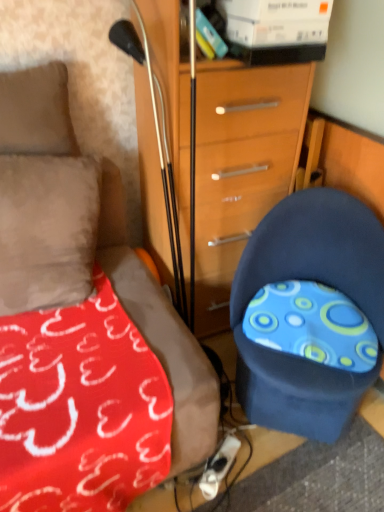
Locate an element on the screen. The image size is (384, 512). wooden chest of drawers at center is located at coordinates (240, 166).

The image size is (384, 512). In order to click on wooden chest of drawers at center in this screenshot , I will do `click(240, 166)`.

From a real-world perspective, is blue fabric chair at lower right above or below wooden chest of drawers at center?

In terms of real-world spatial position, blue fabric chair at lower right is below wooden chest of drawers at center.

Can wooden chest of drawers at center be found inside blue fabric chair at lower right?

Actually, wooden chest of drawers at center is outside blue fabric chair at lower right.

Who is shorter, blue fabric chair at lower right or wooden chest of drawers at center?

blue fabric chair at lower right is shorter.

From the image's perspective, would you say blue fabric chair at lower right is positioned over wooden chest of drawers at center?

Incorrect, from the image's perspective, blue fabric chair at lower right is lower than wooden chest of drawers at center.

Is wooden chest of drawers at center positioned with its back to suede-like beige pillow at upper left?

wooden chest of drawers at center does not have its back to suede-like beige pillow at upper left.

Would you say wooden chest of drawers at center is outside suede-like beige pillow at upper left?

That's correct, wooden chest of drawers at center is outside of suede-like beige pillow at upper left.

You are a GUI agent. You are given a task and a screenshot of the screen. Output one action in this format:
    pyautogui.click(x=<x>, y=<y>)
    Task: Click on the chest of drawers that is in front of the suede-like beige pillow at upper left
    This screenshot has width=384, height=512.
    Given the screenshot: What is the action you would take?
    pyautogui.click(x=240, y=166)

Is wooden chest of drawers at center smaller than suede-like beige pillow at upper left?

No.

From the image's perspective, between blue fabric chair at lower right and suede-like beige pillow at upper left, who is located below?

Result: blue fabric chair at lower right.

Considering the positions of point (362, 229) and point (57, 148), is point (362, 229) closer or farther from the camera than point (57, 148)?

Clearly, point (362, 229) is more distant from the camera than point (57, 148).

The width and height of the screenshot is (384, 512). I want to click on chair on the right side of suede-like beige pillow at upper left, so click(x=312, y=279).

Is wooden chest of drawers at center closer to camera compared to blue fabric chair at lower right?

No, wooden chest of drawers at center is further to the viewer.

Can blue fabric chair at lower right be found inside wooden chest of drawers at center?

Actually, blue fabric chair at lower right is outside wooden chest of drawers at center.

Find the location of `the chest of drawers behind the blue fabric chair at lower right`. the chest of drawers behind the blue fabric chair at lower right is located at coordinates (240, 166).

Which is more to the left, wooden chest of drawers at center or blue fabric chair at lower right?

wooden chest of drawers at center is more to the left.

Does suede-like beige pillow at upper left contain wooden chest of drawers at center?

No, wooden chest of drawers at center is not surrounded by suede-like beige pillow at upper left.

Which is closer, (59,73) or (202,164)?

Clearly, point (59,73) is more distant from the camera than point (202,164).

Does suede-like beige pillow at upper left have a greater height compared to wooden chest of drawers at center?

Incorrect, the height of suede-like beige pillow at upper left is not larger of that of wooden chest of drawers at center.

Is suede-like beige pillow at upper left not near blue fabric chair at lower right?

No, there isn't a large distance between suede-like beige pillow at upper left and blue fabric chair at lower right.

Considering the points (24, 85) and (354, 220), which point is behind, point (24, 85) or point (354, 220)?

Point (354, 220)

Visually, is suede-like beige pillow at upper left positioned to the left or to the right of blue fabric chair at lower right?

suede-like beige pillow at upper left is positioned on blue fabric chair at lower right's left side.

From a real-world perspective, is suede-like beige pillow at upper left below blue fabric chair at lower right?

No, from a real-world perspective, suede-like beige pillow at upper left is not under blue fabric chair at lower right.

Where is `chest of drawers that appears on the left of blue fabric chair at lower right`? chest of drawers that appears on the left of blue fabric chair at lower right is located at coordinates (240, 166).

Identify the location of chest of drawers below the suede-like beige pillow at upper left (from a real-world perspective). The image size is (384, 512). (240, 166).

Which object lies nearer to the anchor point wooden chest of drawers at center, blue fabric chair at lower right or suede-like beige pillow at upper left?

blue fabric chair at lower right.

From the image, which object appears to be nearer to suede-like beige pillow at upper left, blue fabric chair at lower right or wooden chest of drawers at center?

wooden chest of drawers at center.

Which object lies nearer to the anchor point blue fabric chair at lower right, suede-like beige pillow at upper left or wooden chest of drawers at center?

Based on the image, wooden chest of drawers at center appears to be nearer to blue fabric chair at lower right.

When comparing their distances from blue fabric chair at lower right, does wooden chest of drawers at center or suede-like beige pillow at upper left seem further?

Based on the image, suede-like beige pillow at upper left appears to be further to blue fabric chair at lower right.

Based on the photo, which object lies nearer to the anchor point suede-like beige pillow at upper left, wooden chest of drawers at center or blue fabric chair at lower right?

Among the two, wooden chest of drawers at center is located nearer to suede-like beige pillow at upper left.

When comparing their distances from wooden chest of drawers at center, does suede-like beige pillow at upper left or blue fabric chair at lower right seem closer?

The object closer to wooden chest of drawers at center is blue fabric chair at lower right.

Where is `the chest of drawers situated between suede-like beige pillow at upper left and blue fabric chair at lower right from left to right`? the chest of drawers situated between suede-like beige pillow at upper left and blue fabric chair at lower right from left to right is located at coordinates (240, 166).